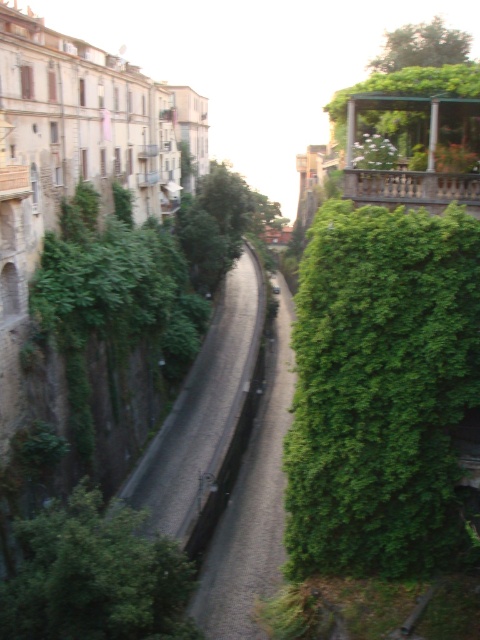
Who is more forward, [346,538] or [37,552]?

Point [37,552] is in front.

Can you confirm if green leafy hedge at right is bigger than green leafy hedge at lower left?

No, green leafy hedge at right is not bigger than green leafy hedge at lower left.

The width and height of the screenshot is (480, 640). What are the coordinates of `green leafy hedge at right` in the screenshot? It's located at (381, 390).

Between green leafy hedge at lower left and green leafy tree at upper center, which one appears on the right side from the viewer's perspective?

green leafy tree at upper center

Does green leafy hedge at lower left appear under green leafy tree at upper center?

Indeed, green leafy hedge at lower left is positioned under green leafy tree at upper center.

Does point (162, 608) come farther from viewer compared to point (444, 33)?

No, (162, 608) is in front of (444, 33).

This screenshot has height=640, width=480. In order to click on green leafy hedge at lower left in this screenshot , I will do `click(95, 577)`.

Can you confirm if green leafy hedge at right is positioned above green leafy tree at upper center?

Actually, green leafy hedge at right is below green leafy tree at upper center.

Which is in front, point (444, 348) or point (372, 61)?

Positioned in front is point (444, 348).

Find the location of a particular element. Image resolution: width=480 pixels, height=640 pixels. green leafy hedge at right is located at coordinates (381, 390).